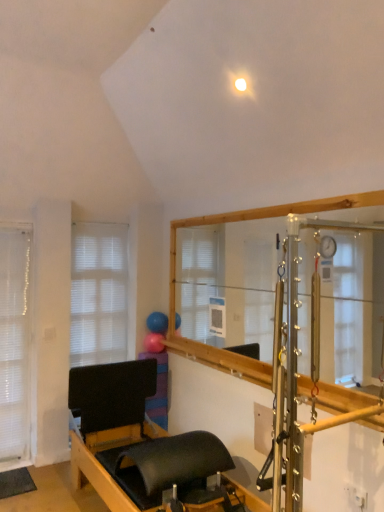
Question: In which direction should I rotate to look at rubber ball at upper center, acting as the 2th balloon starting from the top?

Choices:
 (A) right
 (B) left

Answer: (B)

Question: Considering the relative sizes of rubber ball at upper center, the first balloon when ordered from bottom to top, and black matte bed frame at lower center in the image provided, is rubber ball at upper center, the first balloon when ordered from bottom to top, wider than black matte bed frame at lower center?

Choices:
 (A) yes
 (B) no

Answer: (B)

Question: From the image's perspective, does rubber ball at upper center, acting as the 2th balloon starting from the top, appear higher than black matte bed frame at lower center?

Choices:
 (A) yes
 (B) no

Answer: (A)

Question: Would you say rubber ball at upper center, acting as the 2th balloon starting from the top, is outside black matte bed frame at lower center?

Choices:
 (A) yes
 (B) no

Answer: (A)

Question: Could you tell me if rubber ball at upper center, the first balloon when ordered from bottom to top, is turned towards black matte bed frame at lower center?

Choices:
 (A) no
 (B) yes

Answer: (A)

Question: Does rubber ball at upper center, the first balloon when ordered from bottom to top, have a lesser width compared to black matte bed frame at lower center?

Choices:
 (A) no
 (B) yes

Answer: (B)

Question: Is rubber ball at upper center, acting as the 2th balloon starting from the top, surrounding black matte bed frame at lower center?

Choices:
 (A) yes
 (B) no

Answer: (B)

Question: Considering the relative positions of white sheer curtain at left and rubber ball at upper center, the first balloon when ordered from bottom to top, in the image provided, is white sheer curtain at left to the left of rubber ball at upper center, the first balloon when ordered from bottom to top, from the viewer's perspective?

Choices:
 (A) yes
 (B) no

Answer: (A)

Question: Is white sheer curtain at left not within rubber ball at upper center, the first balloon when ordered from bottom to top?

Choices:
 (A) no
 (B) yes

Answer: (B)

Question: Does white sheer curtain at left have a greater height compared to rubber ball at upper center, the first balloon when ordered from bottom to top?

Choices:
 (A) no
 (B) yes

Answer: (B)

Question: Does white sheer curtain at left have a larger size compared to rubber ball at upper center, the first balloon when ordered from bottom to top?

Choices:
 (A) no
 (B) yes

Answer: (B)

Question: Are white sheer curtain at left and rubber ball at upper center, the first balloon when ordered from bottom to top, far apart?

Choices:
 (A) no
 (B) yes

Answer: (B)

Question: Does white sheer curtain at left have a smaller size compared to rubber ball at upper center, the first balloon when ordered from bottom to top?

Choices:
 (A) no
 (B) yes

Answer: (A)

Question: From the image's perspective, is black matte bed frame at lower center beneath white matte window at left?

Choices:
 (A) yes
 (B) no

Answer: (A)